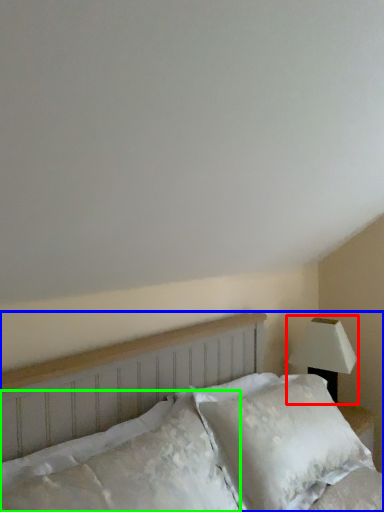
Question: Which object is the farthest from lamp (highlighted by a red box)? Choose among these: bed (highlighted by a blue box) or pillow (highlighted by a green box).

Choices:
 (A) bed
 (B) pillow

Answer: (B)